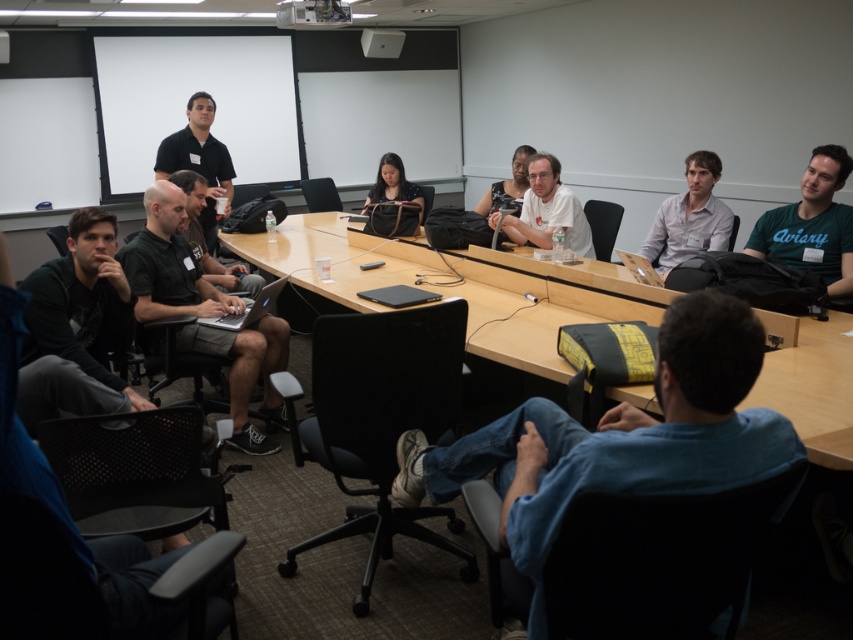
Question: Is black fabric shirt at left to the right of dark gray fabric shirt at center from the viewer's perspective?

Choices:
 (A) no
 (B) yes

Answer: (B)

Question: Considering the real-world distances, which object is closest to the denim jeans at lower right?

Choices:
 (A) matte black shirt at center
 (B) black matte shirt at upper center

Answer: (A)

Question: Considering the real-world distances, which object is closest to the white matte shirt at center?

Choices:
 (A) black fabric shirt at left
 (B) silver metallic laptop at center

Answer: (B)

Question: Which point is closer to the camera?

Choices:
 (A) wooden table at center
 (B) silver metallic laptop at center

Answer: (A)

Question: From the image, what is the correct spatial relationship of light gray shirt at upper right in relation to white matte shirt at center?

Choices:
 (A) below
 (B) above

Answer: (A)

Question: Is black fabric shirt at left closer to the viewer compared to matte brown bag at center?

Choices:
 (A) no
 (B) yes

Answer: (B)